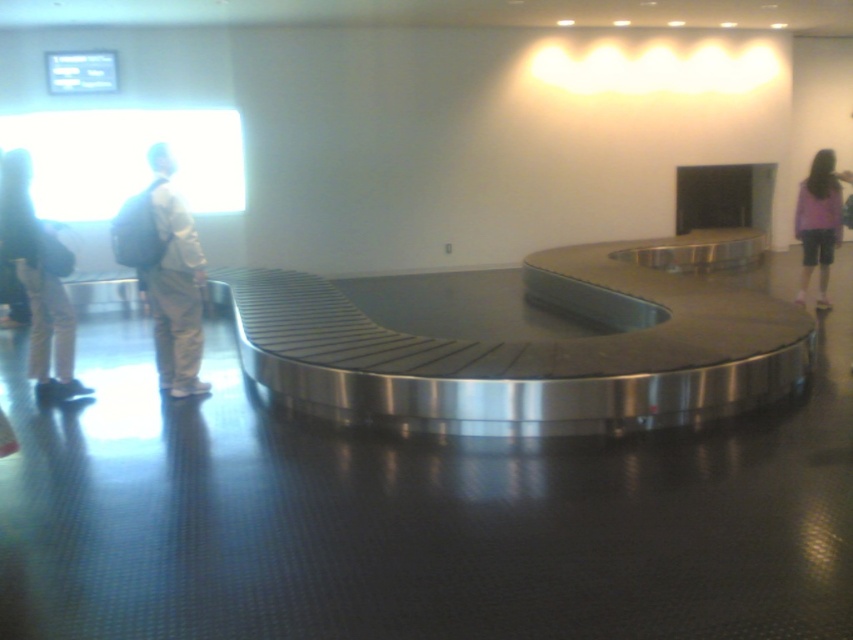
Question: Is matte black backpack at left thinner than matte khaki pants at left?

Choices:
 (A) no
 (B) yes

Answer: (B)

Question: Is matte black backpack at left above purple fabric shorts at right?

Choices:
 (A) no
 (B) yes

Answer: (A)

Question: Which point is closer to the camera taking this photo?

Choices:
 (A) (186, 276)
 (B) (827, 180)
 (C) (45, 250)

Answer: (C)

Question: Based on their relative distances, which object is nearer to the matte khaki pants at left?

Choices:
 (A) matte black backpack at left
 (B) purple fabric shorts at right

Answer: (A)

Question: In this image, where is matte black backpack at left located relative to matte khaki pants at left?

Choices:
 (A) left
 (B) right

Answer: (A)

Question: Among these objects, which one is nearest to the camera?

Choices:
 (A) matte black backpack at left
 (B) purple fabric shorts at right

Answer: (A)